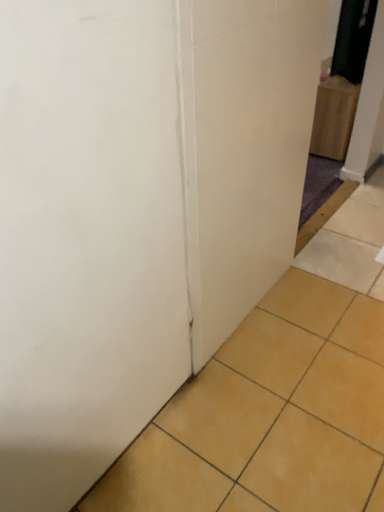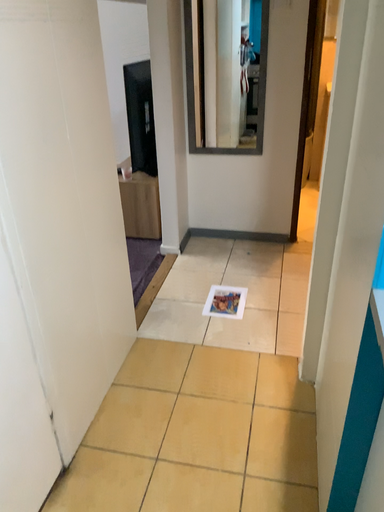
Question: How did the camera likely rotate when shooting the video?

Choices:
 (A) rotated downward
 (B) rotated upward

Answer: (B)